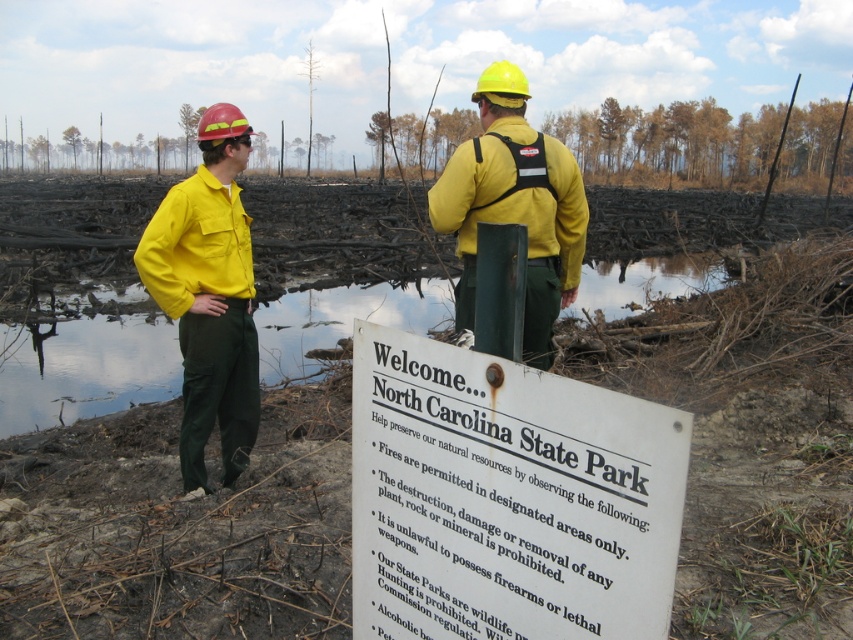
Who is shorter, yellow matte jacket at left or reflective yellow safety vest at center?

With less height is yellow matte jacket at left.

Does point (213, 262) come closer to viewer compared to point (544, 177)?

No, (213, 262) is behind (544, 177).

Which is in front, point (144, 260) or point (517, 161)?

Positioned in front is point (517, 161).

In order to click on yellow matte jacket at left in this screenshot , I will do `click(196, 244)`.

Identify the location of yellow matte vest at center. Image resolution: width=853 pixels, height=640 pixels. 514,205.

Which is more to the left, yellow matte vest at center or yellow matte jacket at left?

From the viewer's perspective, yellow matte jacket at left appears more on the left side.

Measure the distance between point (512, 186) and camera.

The distance of point (512, 186) from camera is 3.22 meters.

Find the location of a particular element. This screenshot has width=853, height=640. yellow matte vest at center is located at coordinates (514, 205).

Between point (407, 328) and point (517, 186), which one is positioned in front?

Point (517, 186) is in front.

I want to click on clear water at sign center, so click(x=86, y=362).

Where is `clear water at sign center`? This screenshot has height=640, width=853. clear water at sign center is located at coordinates (86, 362).